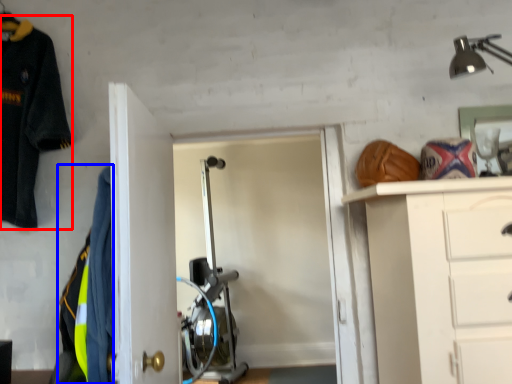
Question: Among these objects, which one is farthest to the camera, uniform (highlighted by a red box) or uniform (highlighted by a blue box)?

Choices:
 (A) uniform
 (B) uniform

Answer: (A)